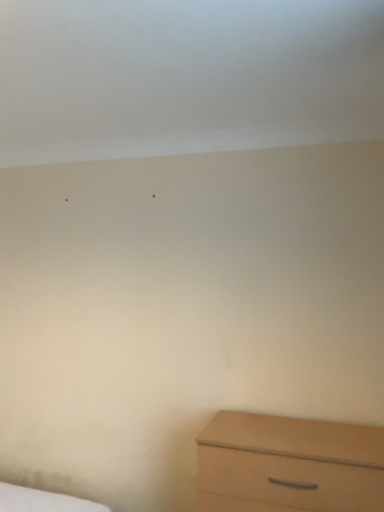
Where is `light brown wood chest of drawers at lower right`? light brown wood chest of drawers at lower right is located at coordinates (288, 465).

Measure the distance between light brown wood chest of drawers at lower right and camera.

The depth of light brown wood chest of drawers at lower right is 4.89 feet.

The width and height of the screenshot is (384, 512). What do you see at coordinates (288, 465) in the screenshot?
I see `light brown wood chest of drawers at lower right` at bounding box center [288, 465].

The width and height of the screenshot is (384, 512). I want to click on light brown wood chest of drawers at lower right, so click(x=288, y=465).